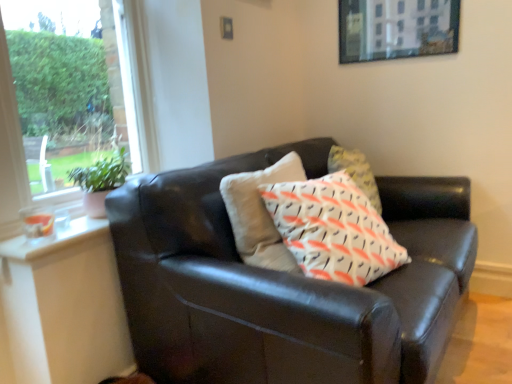
Describe the element at coordinates (10, 145) in the screenshot. I see `clear glass window at upper left` at that location.

Identify the location of clear glass window at upper left. (10, 145).

Would you say matte black couch at center is to the left or to the right of metallic silver picture frame at upper center in the picture?

Clearly, matte black couch at center is on the left of metallic silver picture frame at upper center in the image.

From the image's perspective, is matte black couch at center above or below metallic silver picture frame at upper center?

Clearly, from the image's perspective, matte black couch at center is below metallic silver picture frame at upper center.

Based on the photo, is matte black couch at center wider or thinner than metallic silver picture frame at upper center?

Considering their sizes, matte black couch at center looks broader than metallic silver picture frame at upper center.

Which of these two, metallic silver picture frame at upper center or matte black couch at center, is wider?

matte black couch at center.

Based on the photo, would you say metallic silver picture frame at upper center is a long distance from matte black couch at center?

Absolutely, metallic silver picture frame at upper center is distant from matte black couch at center.

Which is behind, metallic silver picture frame at upper center or matte black couch at center?

metallic silver picture frame at upper center is further away from the camera.

Looking at this image, from a real-world perspective, is metallic silver picture frame at upper center over matte black couch at center?

Yes, from a real-world perspective, metallic silver picture frame at upper center is above matte black couch at center.

Does green leafy plant at left have a larger size compared to clear glass window at upper left?

Actually, green leafy plant at left might be smaller than clear glass window at upper left.

The image size is (512, 384). Find the location of `houseplant lying on the right of clear glass window at upper left`. houseplant lying on the right of clear glass window at upper left is located at coordinates (100, 181).

In the scene shown: From a real-world perspective, between green leafy plant at left and clear glass window at upper left, who is vertically higher?

In real-world perspective, clear glass window at upper left is above.

Considering the relative positions of green leafy plant at left and clear glass window at upper left in the image provided, is green leafy plant at left to the left of clear glass window at upper left from the viewer's perspective?

No, green leafy plant at left is not to the left of clear glass window at upper left.

Considering the positions of objects green leafy plant at left and matte black couch at center in the image provided, who is behind, green leafy plant at left or matte black couch at center?

green leafy plant at left is more distant.

Consider the image. Is green leafy plant at left oriented away from matte black couch at center?

green leafy plant at left is not turned away from matte black couch at center.

From the image's perspective, who appears lower, green leafy plant at left or matte black couch at center?

matte black couch at center.

Between green leafy plant at left and matte black couch at center, which one has more height?

Standing taller between the two is matte black couch at center.

From the image's perspective, does clear glass window at upper left appear higher than matte black couch at center?

Indeed, from the image's perspective, clear glass window at upper left is shown above matte black couch at center.

Could you tell me if clear glass window at upper left is facing matte black couch at center?

No, clear glass window at upper left is not aimed at matte black couch at center.

Are clear glass window at upper left and matte black couch at center far apart?

No, clear glass window at upper left is not far from matte black couch at center.

In the image, is clear glass window at upper left on the left side or the right side of matte black couch at center?

clear glass window at upper left is positioned on matte black couch at center's left side.

Is matte black couch at center positioned in front of clear glass window at upper left?

Yes, it is.

Considering the positions of objects matte black couch at center and clear glass window at upper left in the image provided, who is more to the right, matte black couch at center or clear glass window at upper left?

From the viewer's perspective, matte black couch at center appears more on the right side.

Is matte black couch at center facing away from clear glass window at upper left?

No, matte black couch at center is not facing the opposite direction of clear glass window at upper left.

Can you see matte black couch at center touching clear glass window at upper left?

There is a gap between matte black couch at center and clear glass window at upper left.

Can you tell me how much clear glass window at upper left and metallic silver picture frame at upper center differ in facing direction?

The angular difference between clear glass window at upper left and metallic silver picture frame at upper center is 88.9 degrees.

Is clear glass window at upper left bigger or smaller than metallic silver picture frame at upper center?

Clearly, clear glass window at upper left is larger in size than metallic silver picture frame at upper center.

Where is `picture frame located above the clear glass window at upper left (from the image's perspective)`? This screenshot has height=384, width=512. picture frame located above the clear glass window at upper left (from the image's perspective) is located at coordinates (397, 29).

Is clear glass window at upper left next to metallic silver picture frame at upper center and touching it?

clear glass window at upper left and metallic silver picture frame at upper center are clearly separated.

The height and width of the screenshot is (384, 512). Identify the location of picture frame positioned vertically above the matte black couch at center (from a real-world perspective). (397, 29).

The image size is (512, 384). In order to click on studio couch that appears below the metallic silver picture frame at upper center (from a real-world perspective) in this screenshot , I will do `click(284, 284)`.

Looking at the image, which one is located closer to metallic silver picture frame at upper center, green leafy plant at left or clear glass window at upper left?

Based on the image, green leafy plant at left appears to be nearer to metallic silver picture frame at upper center.

Looking at the image, which one is located closer to green leafy plant at left, clear glass window at upper left or metallic silver picture frame at upper center?

Among the two, clear glass window at upper left is located nearer to green leafy plant at left.

Looking at the image, which one is located closer to metallic silver picture frame at upper center, green leafy plant at left or matte black couch at center?

Based on the image, matte black couch at center appears to be nearer to metallic silver picture frame at upper center.

Which object lies further to the anchor point clear glass window at upper left, green leafy plant at left or metallic silver picture frame at upper center?

Based on the image, metallic silver picture frame at upper center appears to be further to clear glass window at upper left.

Considering their positions, is matte black couch at center positioned closer to clear glass window at upper left than green leafy plant at left?

Among the two, green leafy plant at left is located nearer to clear glass window at upper left.

When comparing their distances from matte black couch at center, does clear glass window at upper left or metallic silver picture frame at upper center seem further?

metallic silver picture frame at upper center.

When comparing their distances from metallic silver picture frame at upper center, does matte black couch at center or clear glass window at upper left seem further?

Based on the image, clear glass window at upper left appears to be further to metallic silver picture frame at upper center.

Estimate the real-world distances between objects in this image. Which object is closer to green leafy plant at left, metallic silver picture frame at upper center or matte black couch at center?

matte black couch at center is closer to green leafy plant at left.

Locate an element on the screen. Image resolution: width=512 pixels, height=384 pixels. studio couch between green leafy plant at left and metallic silver picture frame at upper center in the horizontal direction is located at coordinates (284, 284).

At what (x,y) coordinates should I click in order to perform the action: click on studio couch situated between clear glass window at upper left and metallic silver picture frame at upper center from left to right. Please return your answer as a coordinate pair (x, y). Image resolution: width=512 pixels, height=384 pixels. Looking at the image, I should click on (284, 284).

Locate an element on the screen. houseplant situated between clear glass window at upper left and metallic silver picture frame at upper center from left to right is located at coordinates (100, 181).

Image resolution: width=512 pixels, height=384 pixels. Identify the location of houseplant between clear glass window at upper left and matte black couch at center. (100, 181).